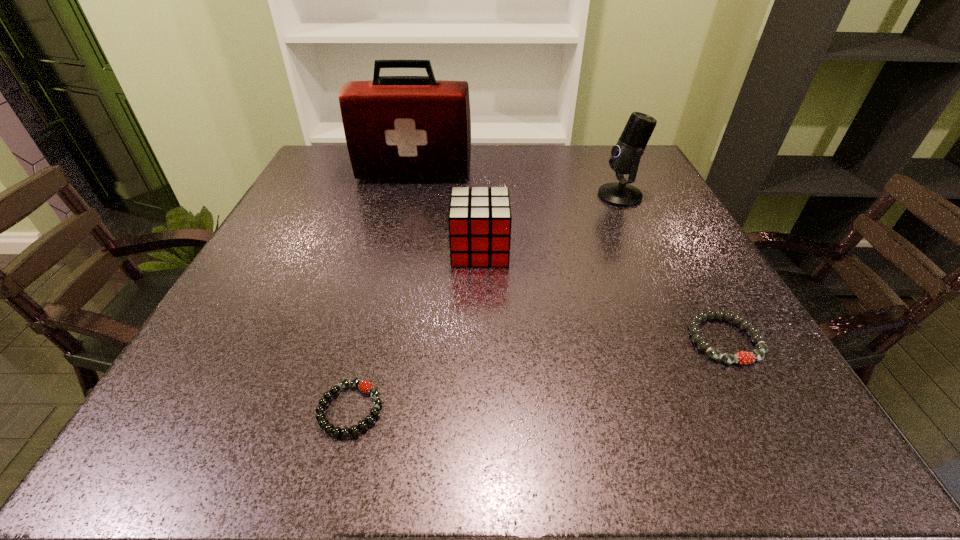
The image size is (960, 540). What are the coordinates of `free space located 0.090m on the stand of the microphone` in the screenshot? It's located at (562, 195).

This screenshot has width=960, height=540. In order to click on free spot located 0.150m on the stand of the microphone in this screenshot , I will do `click(537, 195)`.

The width and height of the screenshot is (960, 540). In order to click on free space located on the left of the cube in this screenshot , I will do `click(347, 250)`.

Image resolution: width=960 pixels, height=540 pixels. I want to click on vacant region located 0.190m on the back of the fourth farthest object, so click(x=674, y=249).

Identify the location of vacant space situated 0.050m on the back of the nearer bracelet. (364, 356).

The image size is (960, 540). In order to click on the first aid kit at the far edge in this screenshot , I will do `click(396, 127)`.

Find the location of `microphone that is positioned at the far edge`. microphone that is positioned at the far edge is located at coordinates (625, 157).

The height and width of the screenshot is (540, 960). I want to click on object located in the near edge section of the desktop, so click(x=368, y=388).

At what (x,y) coordinates should I click in order to perform the action: click on object that is at the left edge. Please return your answer as a coordinate pair (x, y). Looking at the image, I should click on (396, 127).

The height and width of the screenshot is (540, 960). I want to click on microphone that is at the right edge, so click(x=625, y=157).